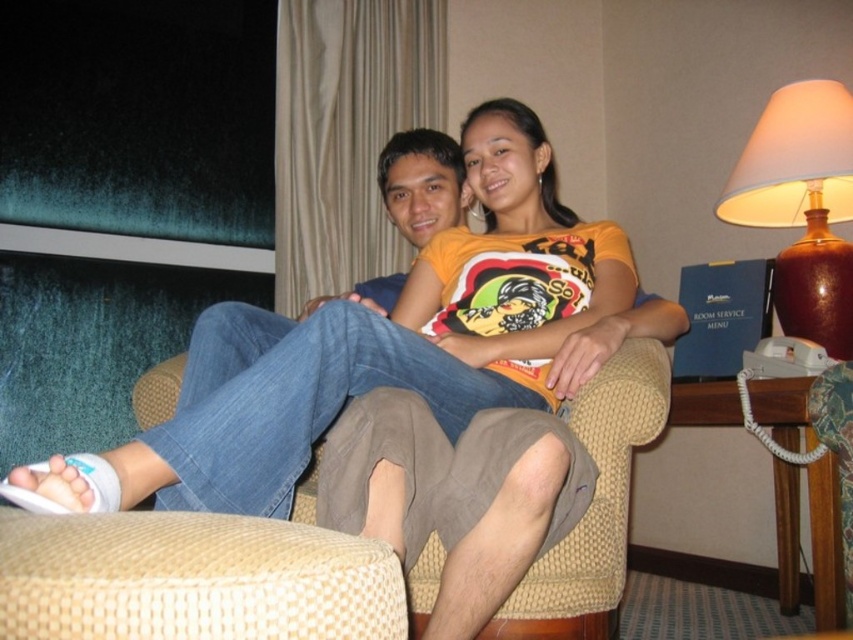
Which is above, white fabric sandals at lower left or brown ceramic lamp at upper right?

brown ceramic lamp at upper right is higher up.

Can you confirm if white fabric sandals at lower left is positioned to the right of brown ceramic lamp at upper right?

Incorrect, white fabric sandals at lower left is not on the right side of brown ceramic lamp at upper right.

The height and width of the screenshot is (640, 853). Find the location of `white fabric sandals at lower left`. white fabric sandals at lower left is located at coordinates (381, 349).

Where is `white fabric sandals at lower left`? This screenshot has width=853, height=640. white fabric sandals at lower left is located at coordinates (381, 349).